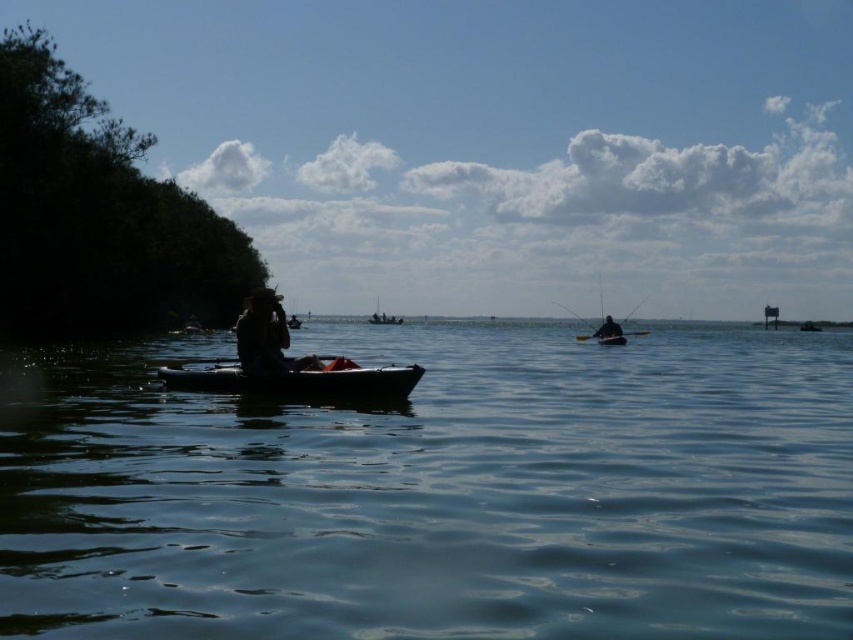
Question: Can you confirm if transparent blue water at center is positioned below black plastic paddle at center?

Choices:
 (A) no
 (B) yes

Answer: (B)

Question: Which of the following is the farthest from the observer?

Choices:
 (A) (606, 317)
 (B) (248, 380)
 (C) (257, 348)

Answer: (A)

Question: Is white plastic canoe at center below white plastic boat at center?

Choices:
 (A) yes
 (B) no

Answer: (A)

Question: Considering the real-world distances, which object is farthest from the black plastic paddle at center?

Choices:
 (A) dark green plastic boat at center
 (B) white plastic boat at center
 (C) transparent blue water at center
 (D) matte brown hat at center

Answer: (A)

Question: Which point is farther to the camera?

Choices:
 (A) transparent blue water at center
 (B) white plastic boat at center
 (C) white plastic canoe at center

Answer: (B)

Question: Can you confirm if matte brown hat at center is positioned below white plastic boat at center?

Choices:
 (A) yes
 (B) no

Answer: (A)